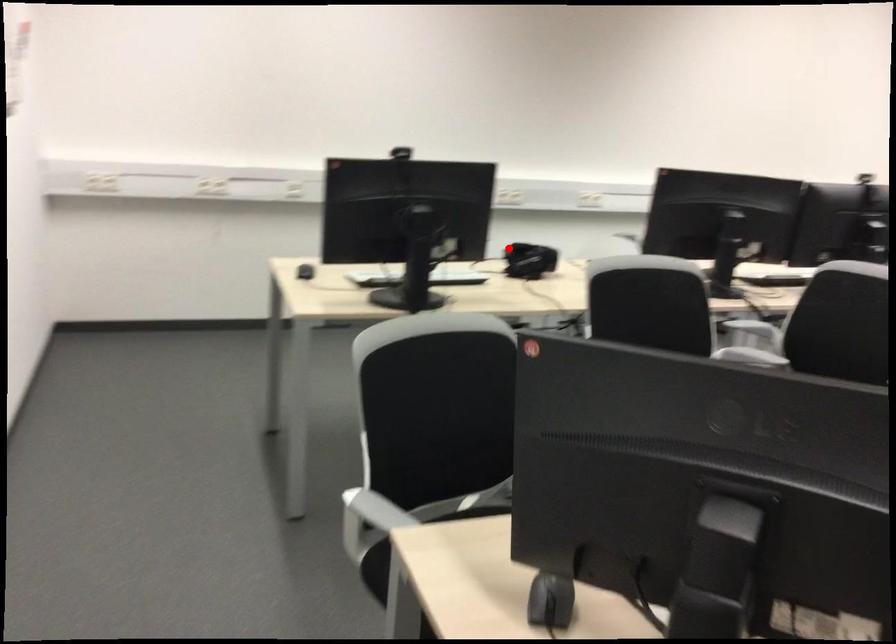
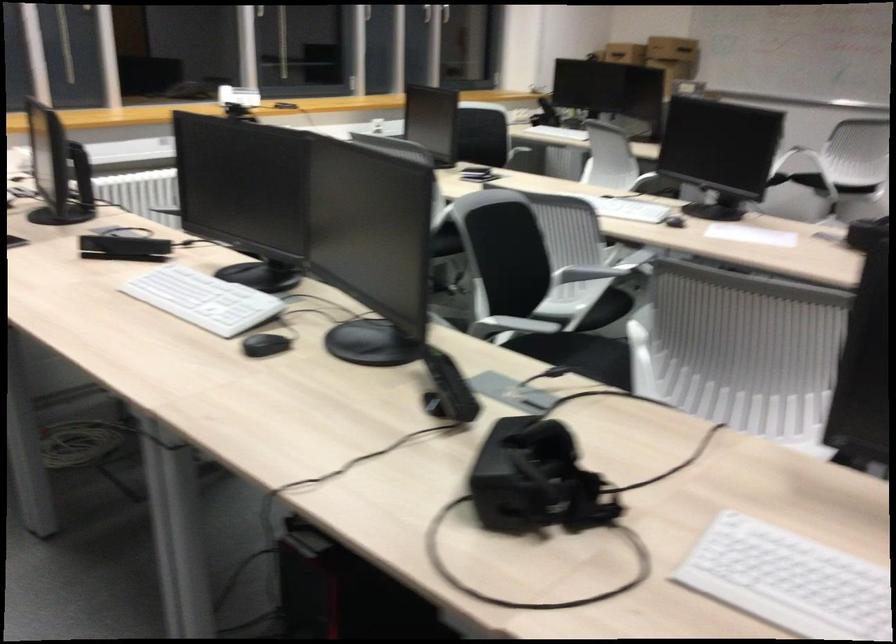
Locate, in the second image, the point that corresponds to the highlighted location in the first image.

(536, 480)